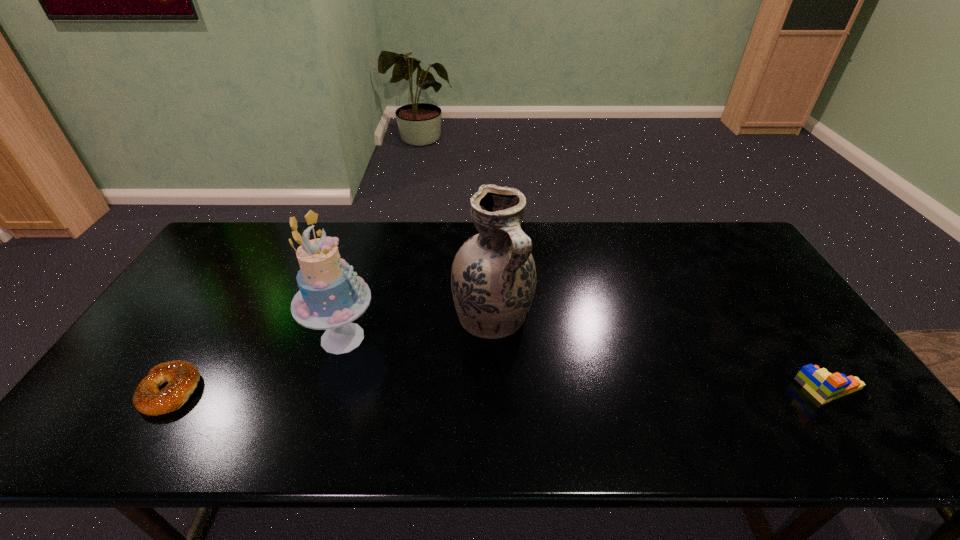
Locate an element on the screen. This screenshot has width=960, height=540. unoccupied position between the leftmost object and the cake is located at coordinates (256, 364).

This screenshot has width=960, height=540. Identify the location of free space between the third object from left to right and the rightmost object. (661, 353).

Identify the location of vacant space in between the Lego and the third object from right to left. (587, 363).

The width and height of the screenshot is (960, 540). I want to click on free point between the second shortest object and the leftmost object, so click(x=501, y=389).

Locate an element on the screen. object that is the nearest to the second object from left to right is located at coordinates (493, 279).

Locate an element on the screen. the second closest object to the vase is located at coordinates (182, 377).

You are a GUI agent. You are given a task and a screenshot of the screen. Output one action in this format:
    pyautogui.click(x=<x>, y=<y>)
    Task: Click on the vacant space that satisfies the following two spatial constraints: 1. on the back side of the cake; 2. on the right side of the shortest object
    
    Given the screenshot: What is the action you would take?
    pyautogui.click(x=204, y=338)

Locate an element on the screen. free space in the image that satisfies the following two spatial constraints: 1. on the back side of the third object from right to left; 2. on the left side of the vase is located at coordinates (348, 317).